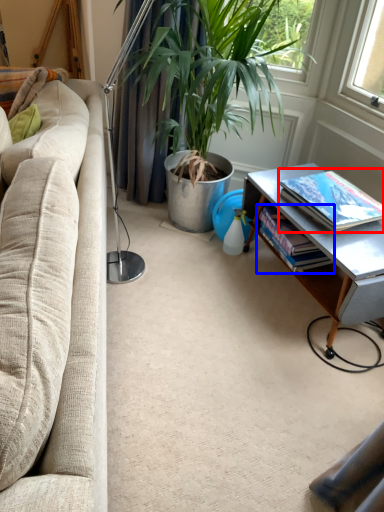
Question: Which object is closer to the camera taking this photo, book (highlighted by a red box) or book (highlighted by a blue box)?

Choices:
 (A) book
 (B) book

Answer: (A)